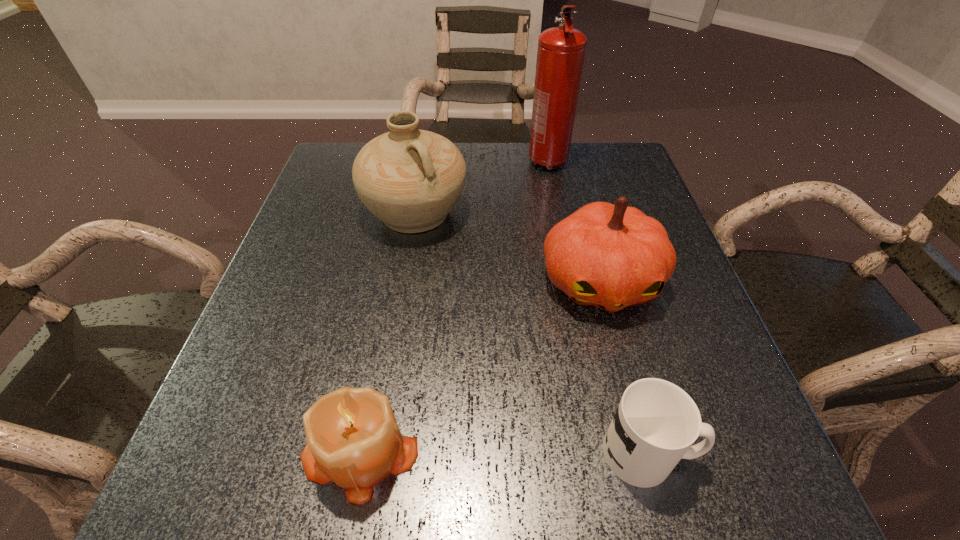
You are a GUI agent. You are given a task and a screenshot of the screen. Output one action in this format:
    pyautogui.click(x=<x>, y=<y>)
    Task: Click on the object positioned at the near left corner
    This screenshot has height=540, width=960.
    Given the screenshot: What is the action you would take?
    pyautogui.click(x=353, y=439)

Locate an element on the screen. Image resolution: width=960 pixels, height=540 pixels. object that is at the near right corner is located at coordinates (656, 422).

This screenshot has height=540, width=960. In the image, there is a desktop. Find the location of `free space at the far edge`. free space at the far edge is located at coordinates (468, 179).

The width and height of the screenshot is (960, 540). What are the coordinates of `free region at the left edge of the desktop` in the screenshot? It's located at (211, 426).

Locate an element on the screen. vacant space at the right edge of the desktop is located at coordinates (631, 199).

This screenshot has width=960, height=540. I want to click on free region at the near left corner, so click(232, 451).

The height and width of the screenshot is (540, 960). In the image, there is a desktop. In order to click on vacant space at the far right corner in this screenshot , I will do (x=596, y=148).

Locate an element on the screen. The height and width of the screenshot is (540, 960). empty space between the fourth tallest object and the mug is located at coordinates (505, 451).

Find the location of a particular element. The image size is (960, 540). unoccupied position between the third shortest object and the pottery is located at coordinates (508, 247).

Locate an element on the screen. This screenshot has height=540, width=960. vacant area that lies between the farthest object and the second shortest object is located at coordinates (454, 306).